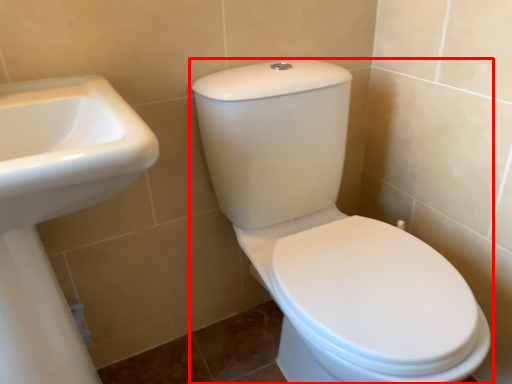
Question: Considering the relative positions of toilet (annotated by the red box) and sink in the image provided, where is toilet (annotated by the red box) located with respect to the staircase?

Choices:
 (A) left
 (B) right

Answer: (B)